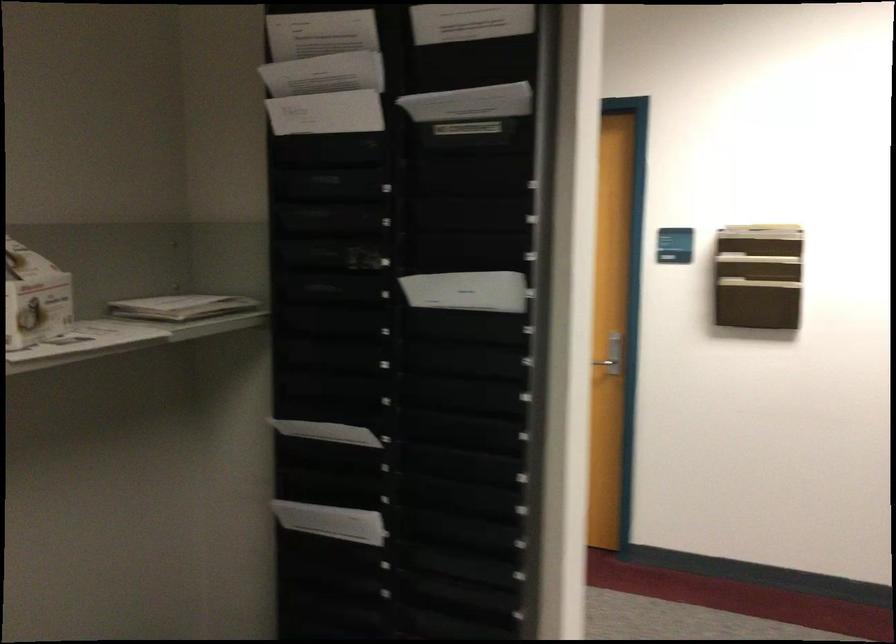
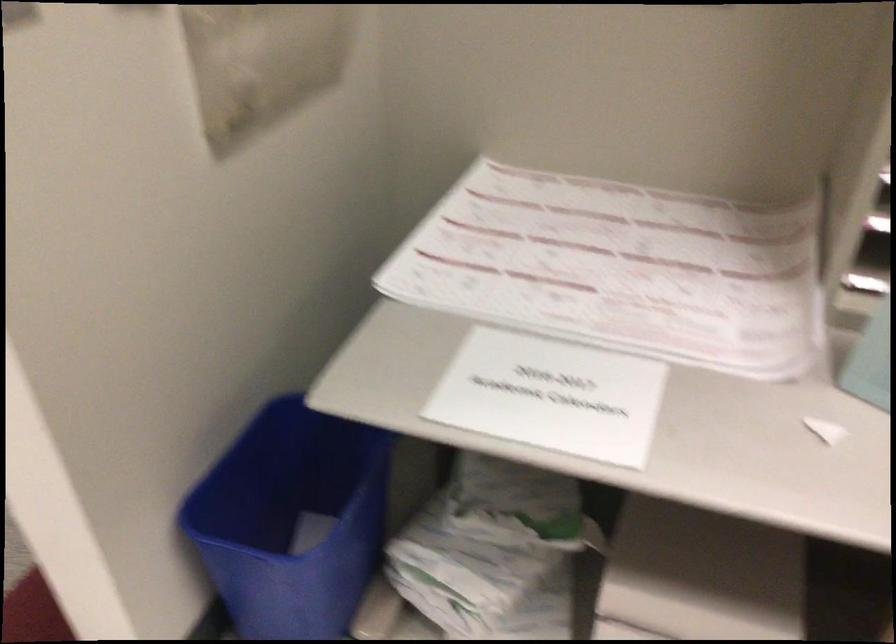
Based on the continuous images, in which direction is the camera rotating?

The camera's rotation is toward right-down.